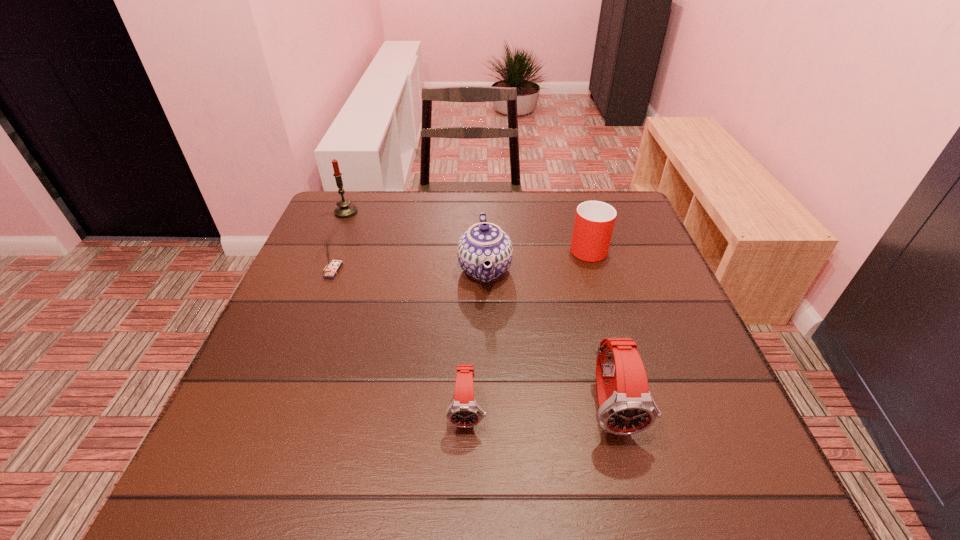
Identify the location of object present at the far right corner. This screenshot has width=960, height=540. (594, 221).

You are a GUI agent. You are given a task and a screenshot of the screen. Output one action in this format:
    pyautogui.click(x=<x>, y=<y>)
    Task: Click on the vacant region at the far edge of the desktop
    
    Given the screenshot: What is the action you would take?
    pyautogui.click(x=384, y=212)

Image resolution: width=960 pixels, height=540 pixels. Find the location of `free space at the near edge of the desktop`. free space at the near edge of the desktop is located at coordinates (570, 436).

Find the location of `vacant space at the left edge`. vacant space at the left edge is located at coordinates (300, 335).

What are the coordinates of `vacant space at the right edge of the desktop` in the screenshot? It's located at tap(688, 324).

Locate an element on the screen. Image resolution: width=960 pixels, height=540 pixels. vacant space at the far left corner is located at coordinates (326, 226).

This screenshot has width=960, height=540. Find the location of `vacant space at the far right corner of the desktop`. vacant space at the far right corner of the desktop is located at coordinates (632, 224).

At what (x,y) coordinates should I click in order to perform the action: click on vacant space that is in between the candle and the matchbox. Please return your answer as a coordinate pair (x, y). The width and height of the screenshot is (960, 540). Looking at the image, I should click on (339, 241).

The height and width of the screenshot is (540, 960). Identify the location of empty location between the chinaware and the candle. (416, 241).

Find the location of `empty space between the right watch and the matchbox`. empty space between the right watch and the matchbox is located at coordinates (472, 339).